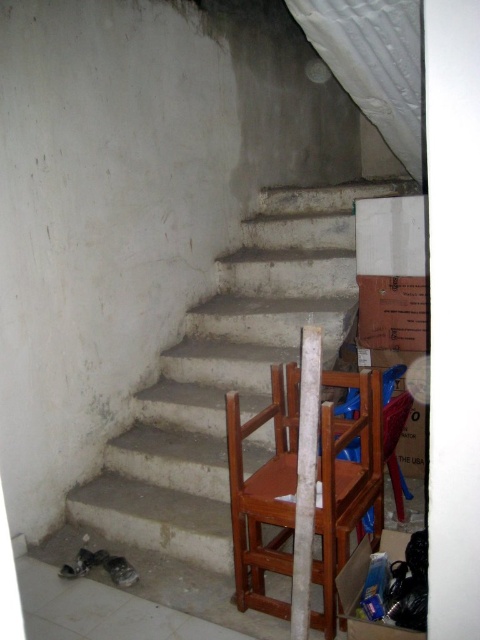
You are moving a brown wooden chair at right into a room and need to carry it down the white concrete stairs at center. Based on their sizes, will the chair fit through the staircase without needing to disassemble it?

The white concrete stairs at center is larger in size than brown wooden chair at right, so the chair should fit through the staircase without needing to be disassembled.

You are standing at the bottom of the white concrete stairs at center in a basement. You need to carry a 2.5 meter long ladder up the stairs. Can you safely lift and carry the ladder vertically while moving up the stairs?

The distance between you and the white concrete stairs at center is 2.34 meters, which is shorter than the ladder length of 2.5 meters. Therefore, you cannot safely lift and carry the ladder vertically up the stairs.

You are carrying a large painting that is 1.2 meters wide. You need to walk down the white concrete stairs at center while avoiding the brown wooden chair at right. Can the painting fit through the staircase without touching the sides?

The white concrete stairs at center are wider than the brown wooden chair at right. Since the painting is 1.2 meters wide, if the stairs are wide enough to accommodate the painting, it should fit. However, the exact width of the stairs isn t specified, so we can only confirm that the stairs are wider than the chair. Without knowing the exact width of the stairs, it s uncertain if the painting will fit.